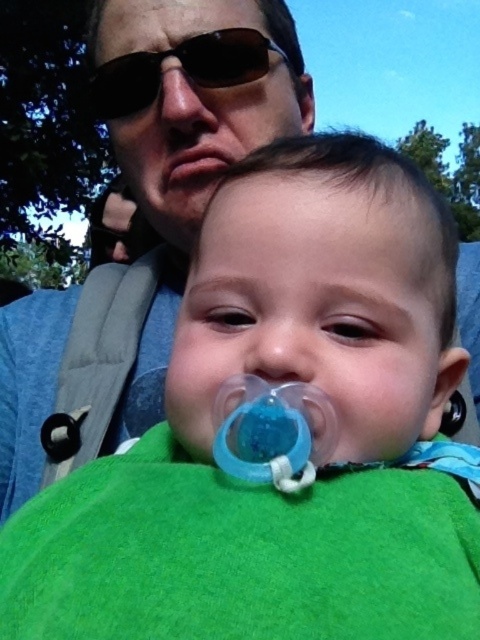
Question: Which point is closer to the camera?

Choices:
 (A) (208, 38)
 (B) (168, 177)

Answer: (A)

Question: Can you confirm if black plastic sunglasses at upper center is wider than pink flesh at center?

Choices:
 (A) yes
 (B) no

Answer: (A)

Question: Does black plastic sunglasses at upper center have a smaller size compared to pink flesh at center?

Choices:
 (A) no
 (B) yes

Answer: (A)

Question: Which object appears closest to the camera in this image?

Choices:
 (A) black plastic sunglasses at upper center
 (B) pink flesh at center

Answer: (A)

Question: Which point appears farthest from the camera in this image?

Choices:
 (A) (196, 51)
 (B) (204, 152)

Answer: (B)

Question: Observing the image, what is the correct spatial positioning of black plastic sunglasses at upper center in reference to pink flesh at center?

Choices:
 (A) left
 (B) right

Answer: (A)